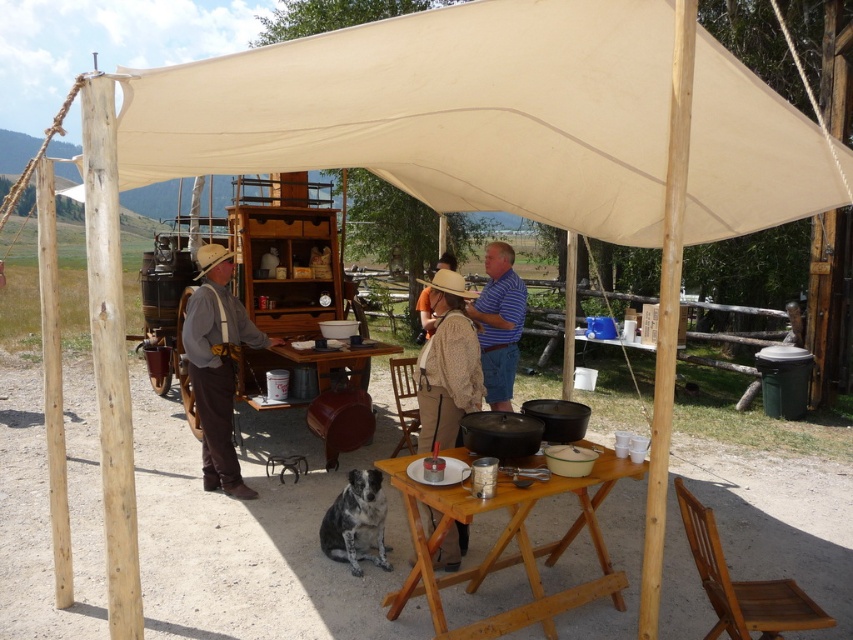
Question: Is beige canvas canopy at upper center to the right of wooden table at center from the viewer's perspective?

Choices:
 (A) no
 (B) yes

Answer: (A)

Question: Among these objects, which one is farthest from the camera?

Choices:
 (A) light brown straw cowboy hat at center
 (B) brown felt cowboy hat at center
 (C) blue striped shirt at center

Answer: (B)

Question: Can you confirm if blue striped shirt at center is positioned to the right of brown felt cowboy hat at center?

Choices:
 (A) no
 (B) yes

Answer: (B)

Question: Is light brown straw cowboy hat at center to the right of brown felt cowboy hat at center from the viewer's perspective?

Choices:
 (A) no
 (B) yes

Answer: (B)

Question: Which object is the closest to the wooden table at center?

Choices:
 (A) light brown straw cowboy hat at center
 (B) brown leather hat at left

Answer: (A)

Question: Among these objects, which one is farthest from the camera?

Choices:
 (A) brown leather hat at left
 (B) wooden table at center

Answer: (A)